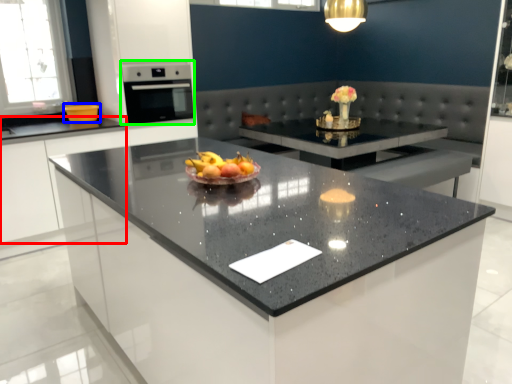
Question: Estimate the real-world distances between objects in this image. Which object is farther from cabinetry (highlighted by a red box), kitchen appliance (highlighted by a blue box) or home appliance (highlighted by a green box)?

Choices:
 (A) kitchen appliance
 (B) home appliance

Answer: (B)